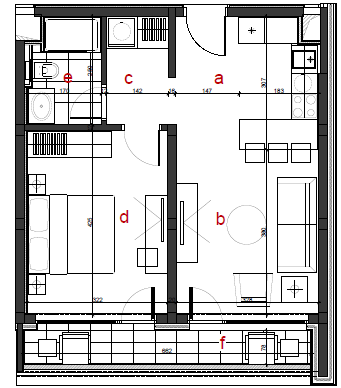
Image resolution: width=341 pixels, height=388 pixels. I want to click on kitchen, so click(249, 64).